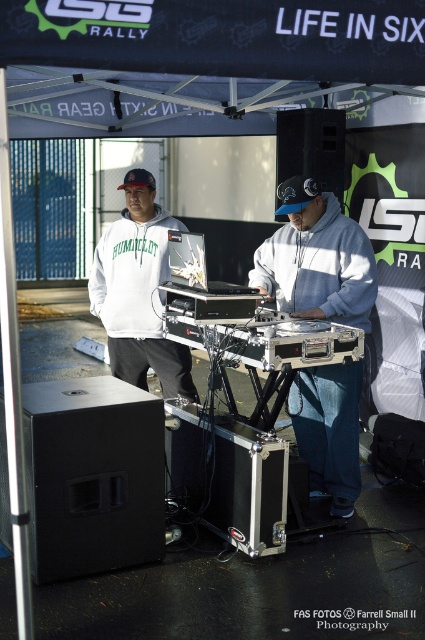
Question: Which object appears farthest from the camera in this image?

Choices:
 (A) gray matte hoodie at center
 (B) white matte hoodie at center

Answer: (B)

Question: Can you confirm if gray matte hoodie at center is thinner than white matte hoodie at center?

Choices:
 (A) no
 (B) yes

Answer: (B)

Question: Which point is closer to the camera?

Choices:
 (A) (130, 376)
 (B) (303, 452)

Answer: (B)

Question: Does gray matte hoodie at center have a lesser width compared to white matte hoodie at center?

Choices:
 (A) no
 (B) yes

Answer: (B)

Question: Does gray matte hoodie at center have a larger size compared to white matte hoodie at center?

Choices:
 (A) no
 (B) yes

Answer: (A)

Question: Which object is farther from the camera taking this photo?

Choices:
 (A) white matte hoodie at center
 (B) gray matte hoodie at center

Answer: (A)